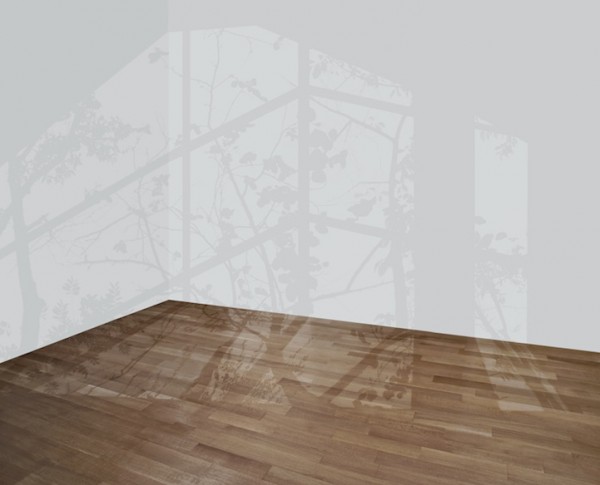
The height and width of the screenshot is (485, 600). I want to click on reflection from window on left wall, so click(76, 242).